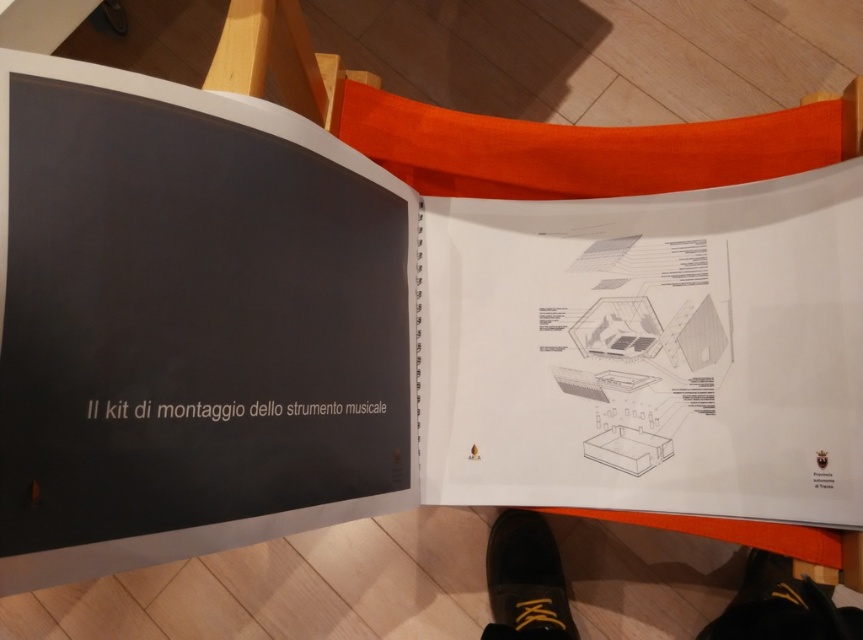
Does black leather shoes at lower center appear on the left side of black leather shoe at lower right?

Yes, black leather shoes at lower center is to the left of black leather shoe at lower right.

Between black leather shoes at lower center and black leather shoe at lower right, which one appears on the left side from the viewer's perspective?

From the viewer's perspective, black leather shoes at lower center appears more on the left side.

What do you see at coordinates (526, 580) in the screenshot?
I see `black leather shoes at lower center` at bounding box center [526, 580].

At what (x,y) coordinates should I click in order to perform the action: click on black leather shoes at lower center. Please return your answer as a coordinate pair (x, y). Looking at the image, I should click on (526, 580).

This screenshot has width=863, height=640. Describe the element at coordinates (526, 580) in the screenshot. I see `black leather shoes at lower center` at that location.

Identify the location of black leather shoes at lower center. (526, 580).

Who is positioned more to the left, black leather shoe at lower center or black leather shoe at lower right?

black leather shoe at lower center

Identify the location of black leather shoe at lower center. This screenshot has width=863, height=640. (526, 580).

This screenshot has width=863, height=640. In order to click on black leather shoe at lower center in this screenshot , I will do `click(526, 580)`.